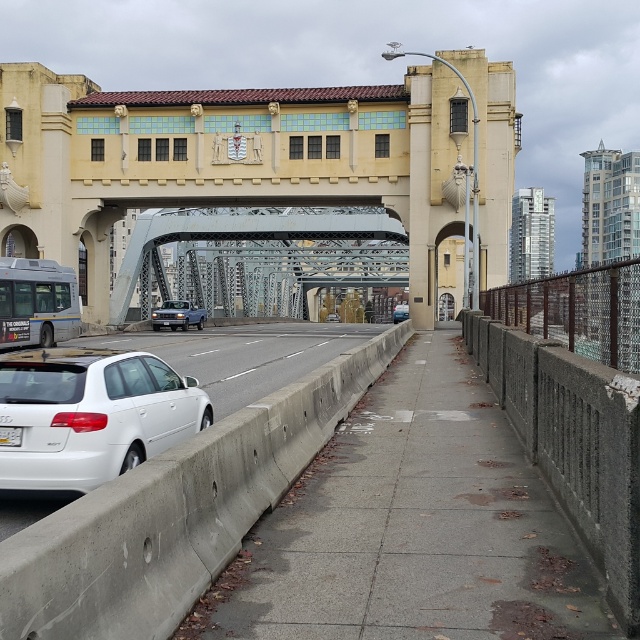
Question: Which object is the farthest from the satin blue sedan at center?

Choices:
 (A) white matte sedan at center
 (B) matte black sedan at center
 (C) white matte hatchback at lower left
 (D) yellow painted steel bridge at center

Answer: (A)

Question: Which point is closer to the camera taking this photo?

Choices:
 (A) (333, 321)
 (B) (54, 344)
 (C) (401, 310)

Answer: (B)

Question: Observing the image, what is the correct spatial positioning of metallic gray bridge at center in reference to matte black sedan at center?

Choices:
 (A) right
 (B) left

Answer: (B)

Question: Does metallic gray bridge at center come behind matte black sedan at center?

Choices:
 (A) yes
 (B) no

Answer: (B)

Question: Is matte black sedan at center wider than white matte sedan at center?

Choices:
 (A) no
 (B) yes

Answer: (B)

Question: Based on their relative distances, which object is farther from the white matte hatchback at lower left?

Choices:
 (A) metallic gray bridge at center
 (B) matte black sedan at center

Answer: (B)